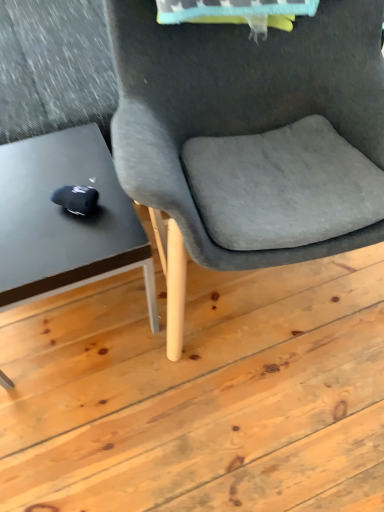
Measure the distance between matte black table at left and camera.

33.83 inches.

Where is `matte black table at left`? The image size is (384, 512). matte black table at left is located at coordinates (65, 220).

The image size is (384, 512). What do you see at coordinates (65, 220) in the screenshot?
I see `matte black table at left` at bounding box center [65, 220].

Where is `suede gray chair at center`? The width and height of the screenshot is (384, 512). suede gray chair at center is located at coordinates (251, 137).

This screenshot has width=384, height=512. Describe the element at coordinates (251, 137) in the screenshot. I see `suede gray chair at center` at that location.

At what (x,y) coordinates should I click in order to perform the action: click on matte black table at left. Please return your answer as a coordinate pair (x, y). The width and height of the screenshot is (384, 512). Looking at the image, I should click on (65, 220).

Looking at this image, can you confirm if matte black table at left is positioned to the left of suede gray chair at center?

Indeed, matte black table at left is positioned on the left side of suede gray chair at center.

From the picture: Which object is further away from the camera taking this photo, matte black table at left or suede gray chair at center?

matte black table at left is further from the camera.

Is point (49, 142) closer to viewer compared to point (174, 59)?

No, (49, 142) is further to viewer.

From the image's perspective, between matte black table at left and suede gray chair at center, which one is located above?

suede gray chair at center, from the image's perspective.

From a real-world perspective, between matte black table at left and suede gray chair at center, who is vertically higher?

In real-world perspective, suede gray chair at center is above.

Considering the relative sizes of matte black table at left and suede gray chair at center in the image provided, is matte black table at left thinner than suede gray chair at center?

Yes, matte black table at left is thinner than suede gray chair at center.

Can you confirm if matte black table at left is shorter than suede gray chair at center?

Indeed, matte black table at left has a lesser height compared to suede gray chair at center.

Which of these two, matte black table at left or suede gray chair at center, is smaller?

matte black table at left is smaller.

In the scene shown: Is suede gray chair at center surrounded by matte black table at left?

Definitely not — suede gray chair at center is not inside matte black table at left.

Is matte black table at left next to suede gray chair at center and touching it?

They are not placed beside each other.

Is matte black table at left turned away from suede gray chair at center?

That's not correct — matte black table at left is not looking away from suede gray chair at center.

What's the angular difference between matte black table at left and suede gray chair at center's facing directions?

There is a 97-degree angle between the facing directions of matte black table at left and suede gray chair at center.

In the image, there is a suede gray chair at center. Identify the location of table below it (from a real-world perspective). tap(65, 220).

Between suede gray chair at center and matte black table at left, which one appears on the left side from the viewer's perspective?

Positioned to the left is matte black table at left.

Which is behind, suede gray chair at center or matte black table at left?

matte black table at left.

From the picture: Which is closer to the camera, [173,276] or [136,231]?

Positioned in front is point [136,231].

From the image's perspective, between suede gray chair at center and matte black table at left, which one is located above?

suede gray chair at center is shown above in the image.

From a real-world perspective, which is physically below, suede gray chair at center or matte black table at left?

In real-world perspective, matte black table at left is lower.

Considering the relative sizes of suede gray chair at center and matte black table at left in the image provided, is suede gray chair at center wider than matte black table at left?

Indeed, suede gray chair at center has a greater width compared to matte black table at left.

Can you confirm if suede gray chair at center is shorter than matte black table at left?

In fact, suede gray chair at center may be taller than matte black table at left.

Who is bigger, suede gray chair at center or matte black table at left?

suede gray chair at center.

Is suede gray chair at center inside or outside of matte black table at left?

suede gray chair at center is located beyond the bounds of matte black table at left.

Is suede gray chair at center far away from matte black table at left?

No, suede gray chair at center is not far from matte black table at left.

Is suede gray chair at center oriented towards matte black table at left?

No, suede gray chair at center does not turn towards matte black table at left.

How different are the orientations of suede gray chair at center and matte black table at left in degrees?

The facing directions of suede gray chair at center and matte black table at left are 97 degrees apart.

Locate an element on the screen. chair above the matte black table at left (from the image's perspective) is located at coordinates (251, 137).

You are a GUI agent. You are given a task and a screenshot of the screen. Output one action in this format:
    pyautogui.click(x=<x>, y=<y>)
    Task: Click on the chair on the right of matte black table at left
    This screenshot has width=384, height=512.
    Given the screenshot: What is the action you would take?
    pyautogui.click(x=251, y=137)

Find the location of a particular element. chair above the matte black table at left (from the image's perspective) is located at coordinates (251, 137).